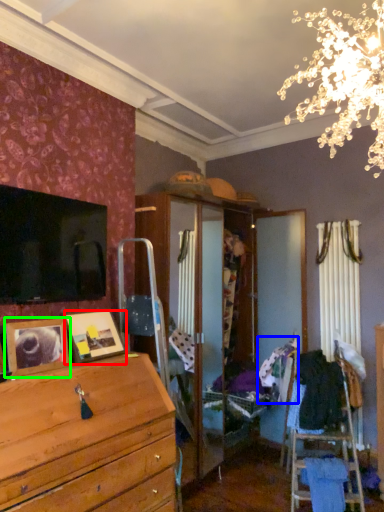
Question: Estimate the real-world distances between objects in this image. Which object is farther from picture frame (highlighted by a red box), clothing (highlighted by a blue box) or picture frame (highlighted by a green box)?

Choices:
 (A) clothing
 (B) picture frame

Answer: (A)